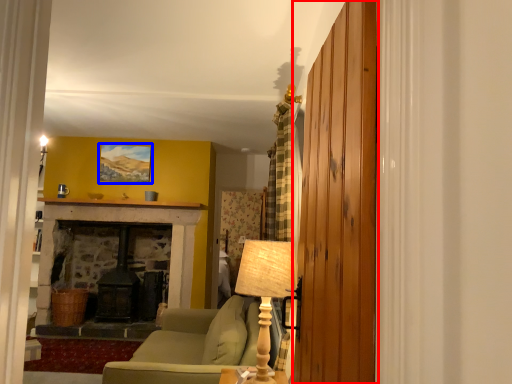
Question: Which object is further to the camera taking this photo, barn door (highlighted by a red box) or picture frame (highlighted by a blue box)?

Choices:
 (A) barn door
 (B) picture frame

Answer: (B)